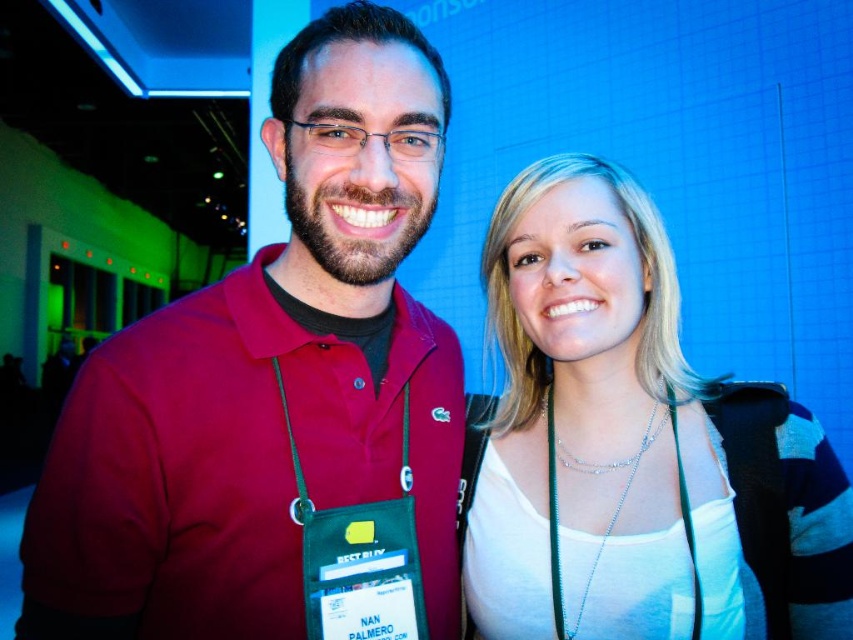
Question: Observing the image, what is the correct spatial positioning of matte red polo shirt at center in reference to silver chain lanyard at center?

Choices:
 (A) right
 (B) left

Answer: (B)

Question: Does matte red polo shirt at center have a larger size compared to silver chain lanyard at center?

Choices:
 (A) no
 (B) yes

Answer: (B)

Question: Which point is farther from the camera taking this photo?

Choices:
 (A) [x=683, y=508]
 (B) [x=521, y=292]

Answer: (B)

Question: Which point is closer to the camera taking this photo?

Choices:
 (A) (711, 432)
 (B) (563, 634)

Answer: (B)

Question: Is matte red polo shirt at center closer to the viewer compared to silver chain lanyard at center?

Choices:
 (A) yes
 (B) no

Answer: (A)

Question: Which point is closer to the camera?

Choices:
 (A) (697, 604)
 (B) (509, 230)
 (C) (91, 506)

Answer: (C)